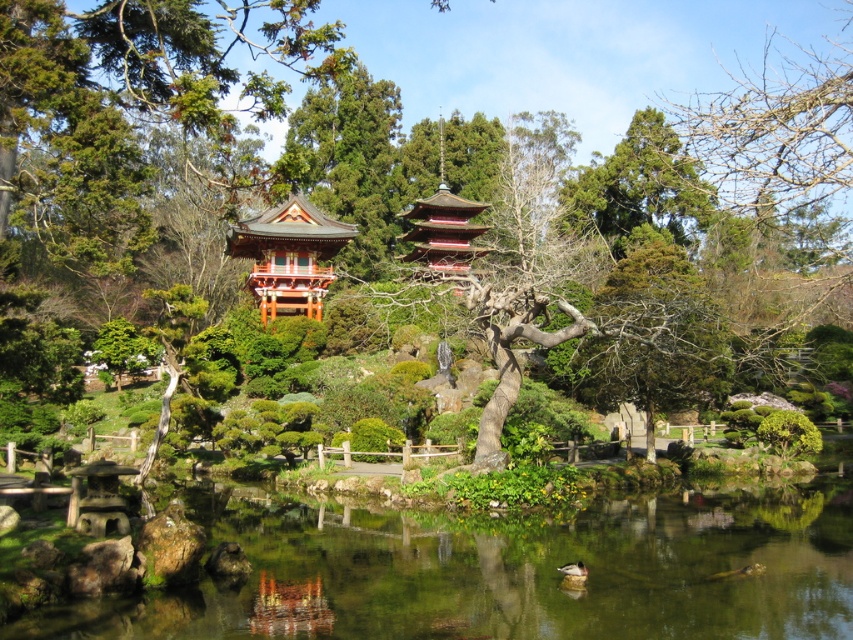
Looking at this image, you are a visitor in the Japanese garden and want to take a photo of both the clear water at center and the shiny red pagoda at center. The camera you have can only focus on objects within a 30 meter distance. Will both objects be in focus if you try to capture them in the same frame?

The clear water at center and shiny red pagoda at center are 40.26 meters apart. Since the camera can only focus within 30 meters, the distance between them exceeds the camera focus range. Therefore, both objects cannot be in focus simultaneously in the same frame.

From the picture: You are a visitor in the garden and want to take a photo of both the clear water at center and the shiny red pagoda at center. Since you want both to be clearly visible in the frame, would you need to adjust your camera to focus on something closer or farther away?

The clear water at center has a smaller size compared to shiny red pagoda at center, which suggests that the clear water at center is closer to you. To ensure both are in focus, you should adjust your camera to focus on the closer object, the clear water at center.

In the scene shown: You are a visitor in the garden and want to take a photo of the shiny red pagoda at center. Since you are standing on the clear water at center, can you take the photo without getting your camera wet?

The clear water at center is below the shiny red pagoda at center, so if you are standing on the clear water at center, you are actually on the water surface. To take a photo of the pagoda, you can do so without getting your camera wet as long as you keep it above the water.